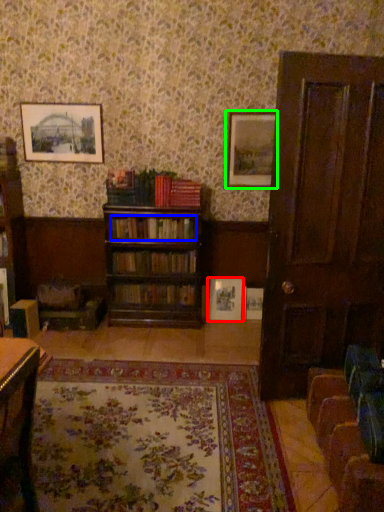
Question: Considering the real-world distances, which object is closest to picture frame (highlighted by a red box)? book (highlighted by a blue box) or picture frame (highlighted by a green box).

Choices:
 (A) book
 (B) picture frame

Answer: (A)